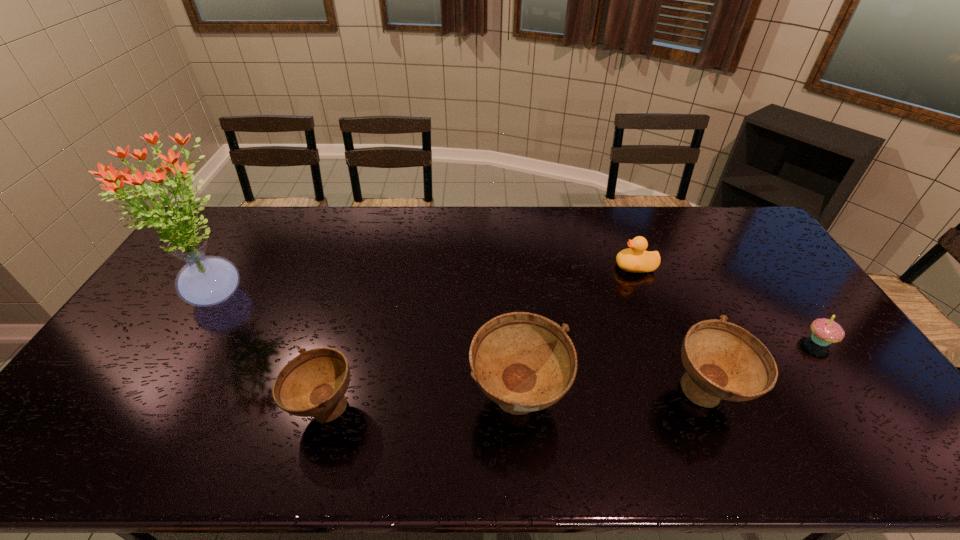
Find the location of a particular element. the leftmost soup bowl is located at coordinates point(314,383).

Locate an element on the screen. The image size is (960, 540). the second object from left to right is located at coordinates (314, 383).

Image resolution: width=960 pixels, height=540 pixels. Find the location of `the third object from left to right`. the third object from left to right is located at coordinates (524, 362).

Where is `the second tallest soup bowl`? The height and width of the screenshot is (540, 960). the second tallest soup bowl is located at coordinates (722, 360).

You are a GUI agent. You are given a task and a screenshot of the screen. Output one action in this format:
    pyautogui.click(x=<x>, y=<y>)
    Task: Click on the third tallest object
    The height and width of the screenshot is (540, 960).
    Given the screenshot: What is the action you would take?
    pyautogui.click(x=722, y=360)

Where is `duck`? The height and width of the screenshot is (540, 960). duck is located at coordinates (636, 259).

Locate an element on the screen. the rightmost object is located at coordinates (824, 331).

This screenshot has width=960, height=540. In order to click on the tallest object in this screenshot , I will do `click(204, 281)`.

This screenshot has height=540, width=960. What are the coordinates of `flower arrangement` in the screenshot? It's located at (204, 281).

Where is `free space located on the left of the fourth tallest object`? The image size is (960, 540). free space located on the left of the fourth tallest object is located at coordinates (246, 409).